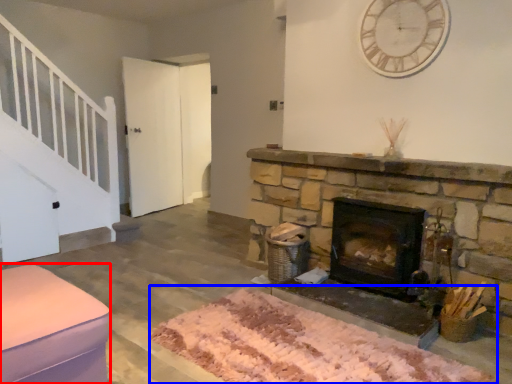
Question: Which point is closer to the camera, furniture (highlighted by a red box) or mat (highlighted by a blue box)?

Choices:
 (A) furniture
 (B) mat

Answer: (B)